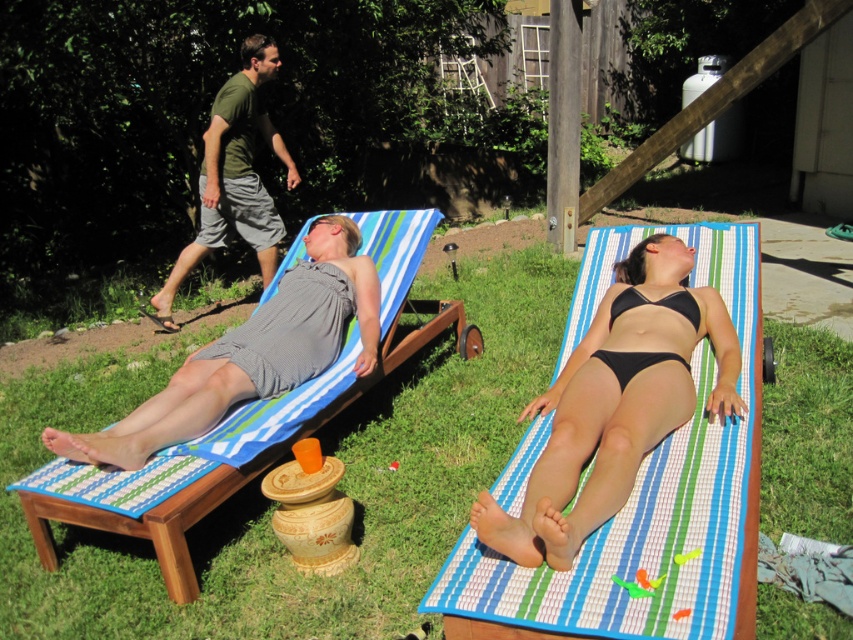
You are a photographer trying to capture a clear shot of the black bikini at center and the wooden daybed at left. Based on their positions, which object should you focus on first to ensure both are in the frame?

The black bikini at center is in front of the wooden daybed at left, so you should focus on the wooden daybed at left first to ensure both are in the frame.

You are standing in the backyard and want to place a small potted plant between the wooden daybed at left and the green fabric shorts at upper left. Which object should the plant be closer to?

The wooden daybed at left is closer to the viewer than the green fabric shorts at upper left, so the plant should be placed closer to the wooden daybed at left to maintain equal visual distance from both objects.

You are standing at the point with coordinates point at (x=238, y=426). Which object are you on?

You are on the wooden daybed at left.